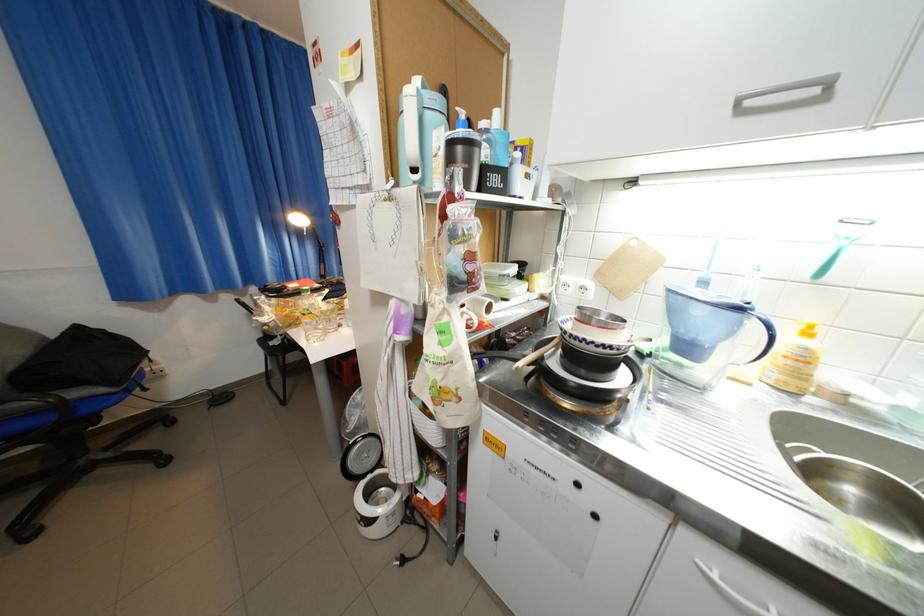
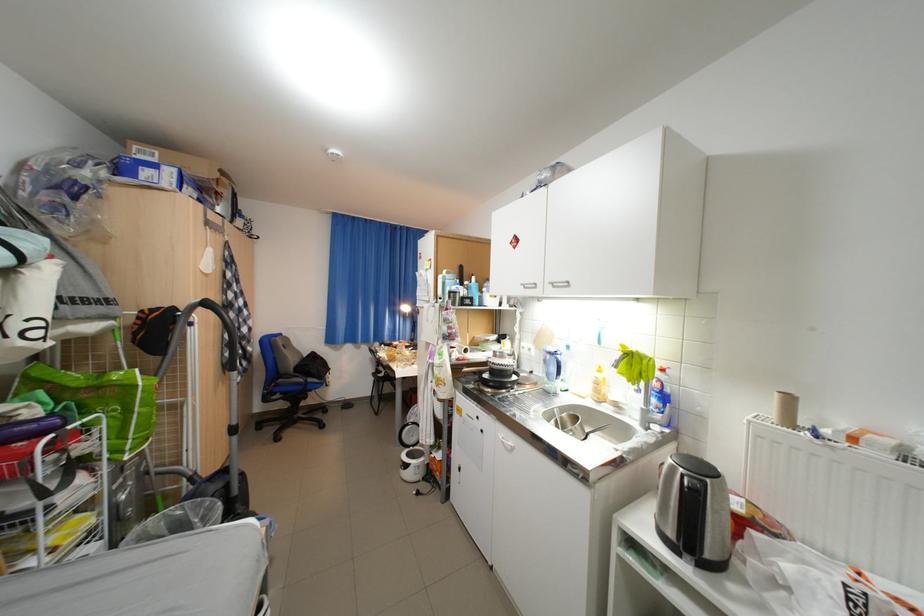
In the second image, find the point that corresponds to point (698, 349) in the first image.

(560, 376)